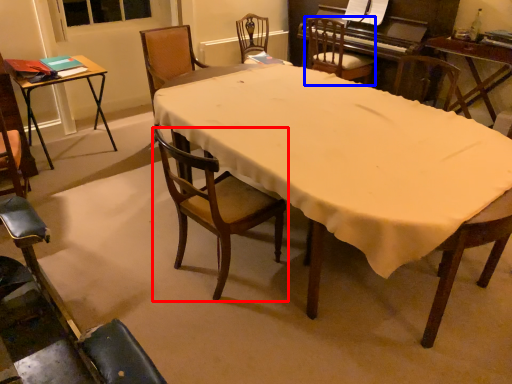
Question: Which object is closer to the camera taking this photo, chair (highlighted by a red box) or chair (highlighted by a blue box)?

Choices:
 (A) chair
 (B) chair

Answer: (A)